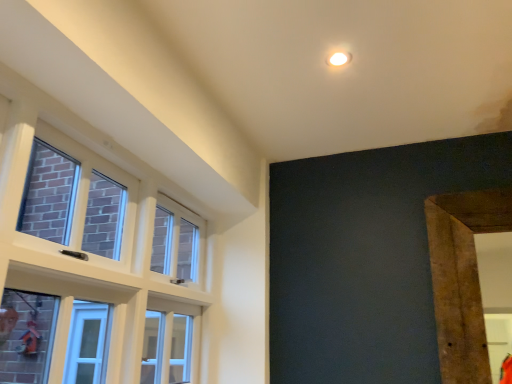
Where is `white painted wood window at left`? The image size is (512, 384). white painted wood window at left is located at coordinates (93, 250).

The height and width of the screenshot is (384, 512). What do you see at coordinates (93, 250) in the screenshot? I see `white painted wood window at left` at bounding box center [93, 250].

I want to click on white painted wood window at left, so click(93, 250).